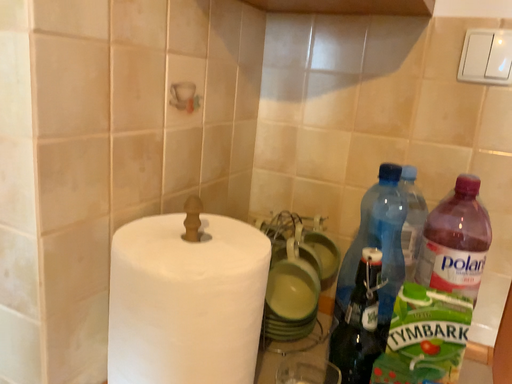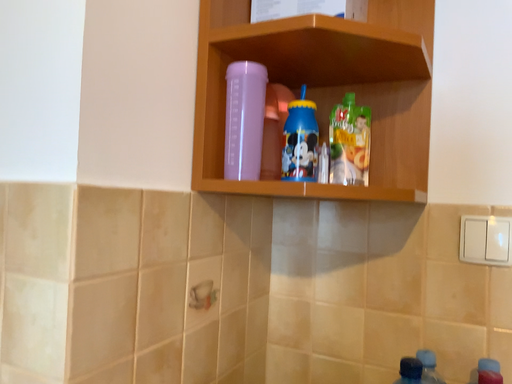
Question: How did the camera likely rotate when shooting the video?

Choices:
 (A) rotated upward
 (B) rotated downward

Answer: (A)